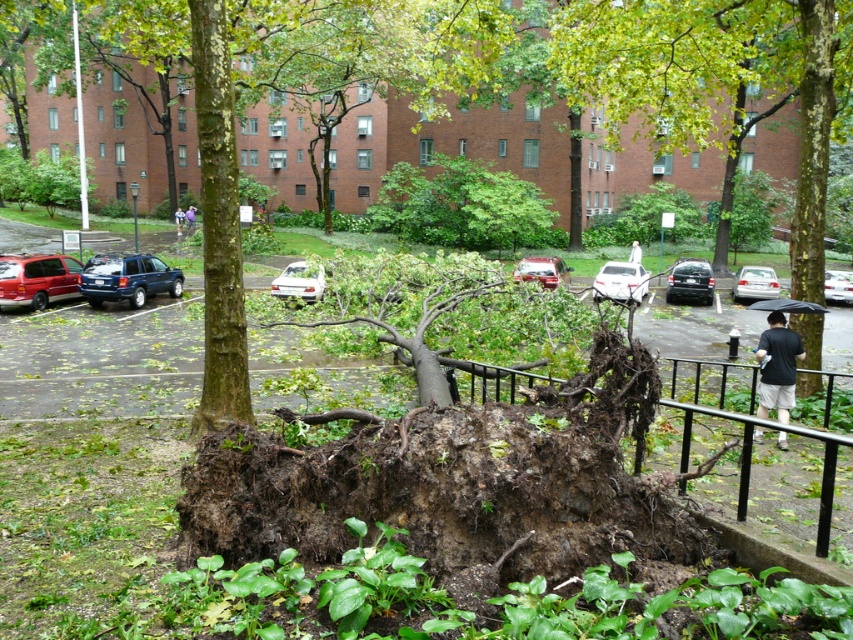
Question: Is black cotton shirt at lower right to the right of white glossy sedan at center from the viewer's perspective?

Choices:
 (A) no
 (B) yes

Answer: (A)

Question: Which object is closer to the camera taking this photo?

Choices:
 (A) silver metallic sedan at center
 (B) white matte car at center
 (C) white glossy sedan at center

Answer: (B)

Question: Is black metal railing at lower right above matte red van at left?

Choices:
 (A) no
 (B) yes

Answer: (A)

Question: Which of the following is the closest to the observer?

Choices:
 (A) (310, 285)
 (B) (747, 285)
 (C) (621, 285)

Answer: (A)

Question: Which of the following is the closest to the observer?

Choices:
 (A) blue metallic suv at center
 (B) silver metallic sedan at center

Answer: (A)

Question: Where is silver metallic sedan at center located in relation to metallic silver sedan at center in the image?

Choices:
 (A) above
 (B) below

Answer: (B)